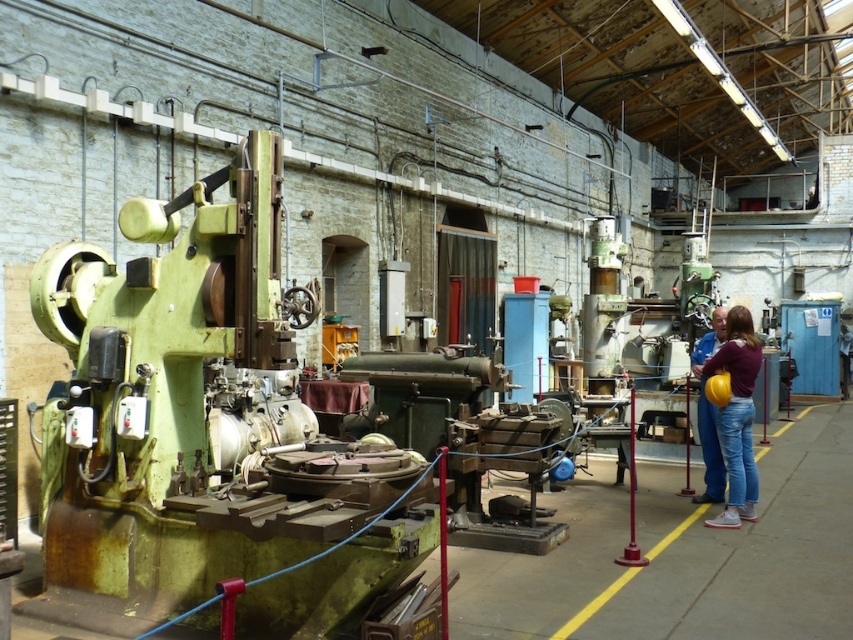
You are a maintenance worker in the workshop. You need to inspect both the green metallic machine at left and the maroon fabric shirt at center. Which object will require you to look upwards more when inspecting it?

The green metallic machine at left is taller than the maroon fabric shirt at center, so you will need to look upwards more when inspecting the green metallic machine at left.